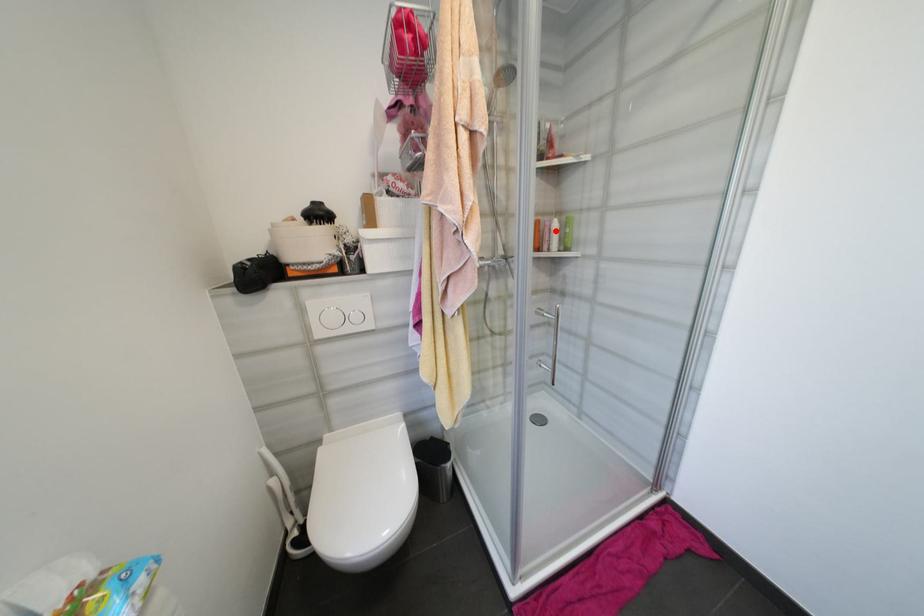
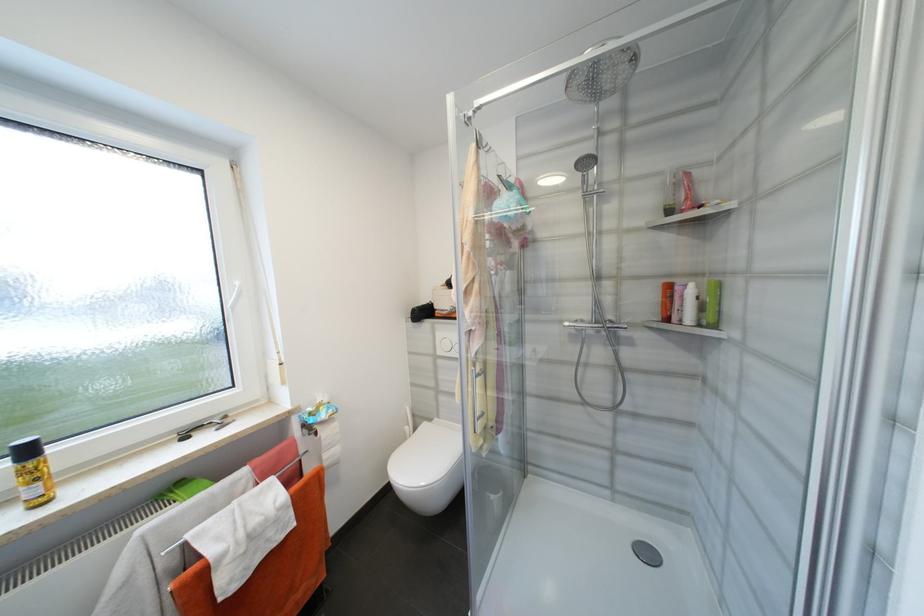
The point at the highlighted location is marked in the first image. Where is the corresponding point in the second image?

(687, 297)